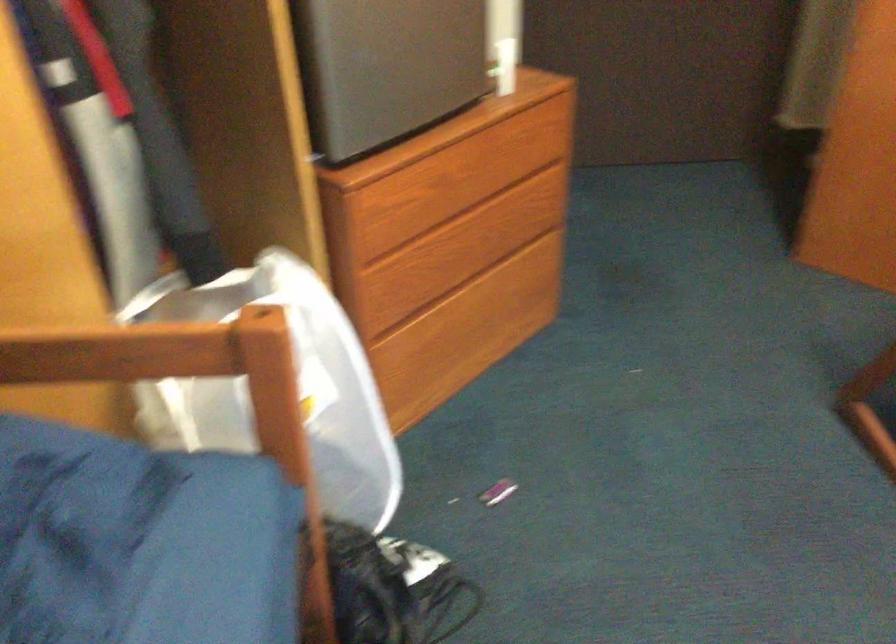
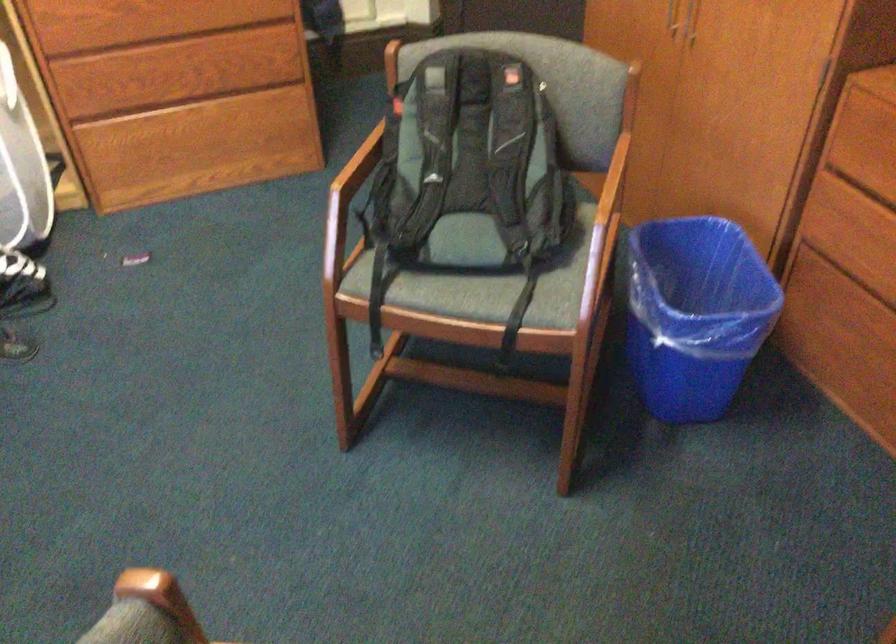
Question: The images are taken continuously from a first-person perspective. In which direction are you moving?

Choices:
 (A) Left
 (B) Right
 (C) Forward
 (D) Backward

Answer: (B)